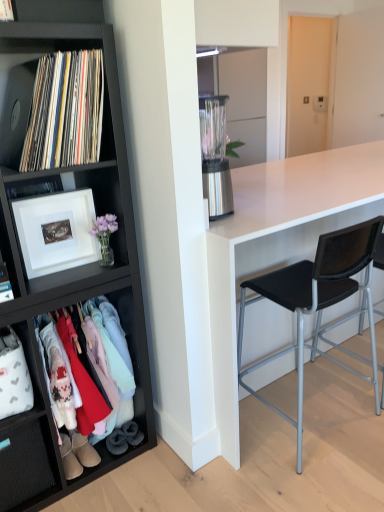
Question: Is white fabric drawer at lower left to the left of leather boot at lower left, which appears as the second footwear when viewed from the right, from the viewer's perspective?

Choices:
 (A) yes
 (B) no

Answer: (A)

Question: Considering the relative sizes of white fabric drawer at lower left and leather boot at lower left, which appears as the second footwear when viewed from the right, in the image provided, is white fabric drawer at lower left bigger than leather boot at lower left, which appears as the second footwear when viewed from the right,?

Choices:
 (A) yes
 (B) no

Answer: (A)

Question: Is leather boot at lower left, which appears as the second footwear when viewed from the right, inside white fabric drawer at lower left?

Choices:
 (A) yes
 (B) no

Answer: (B)

Question: Is white fabric drawer at lower left positioned behind leather boot at lower left, which appears as the second footwear when viewed from the right?

Choices:
 (A) no
 (B) yes

Answer: (A)

Question: Is white fabric drawer at lower left not inside leather boot at lower left, which appears as the second footwear when viewed from the right?

Choices:
 (A) yes
 (B) no

Answer: (A)

Question: From the image's perspective, is white fabric drawer at lower left above or below light brown suede boot at lower left, which ranks as the first footwear in right-to-left order?

Choices:
 (A) below
 (B) above

Answer: (B)

Question: Considering the positions of white fabric drawer at lower left and light brown suede boot at lower left, the second footwear when ordered from left to right, in the image, is white fabric drawer at lower left bigger or smaller than light brown suede boot at lower left, the second footwear when ordered from left to right,?

Choices:
 (A) small
 (B) big

Answer: (B)

Question: Is white fabric drawer at lower left in front of or behind light brown suede boot at lower left, which ranks as the first footwear in right-to-left order, in the image?

Choices:
 (A) front
 (B) behind

Answer: (A)

Question: From a real-world perspective, relative to light brown suede boot at lower left, which ranks as the first footwear in right-to-left order, is white fabric drawer at lower left vertically above or below?

Choices:
 (A) below
 (B) above

Answer: (B)

Question: Is point (342, 260) closer or farther from the camera than point (134, 226)?

Choices:
 (A) closer
 (B) farther

Answer: (A)

Question: Is black mesh chair at right, the second chair viewed from the right, taller or shorter than black matte bookcase at left?

Choices:
 (A) tall
 (B) short

Answer: (B)

Question: Is black mesh chair at right, the second chair viewed from the right, situated inside black matte bookcase at left or outside?

Choices:
 (A) inside
 (B) outside

Answer: (B)

Question: From the image's perspective, relative to black matte bookcase at left, is black mesh chair at right, which is the 1th chair in left-to-right order, above or below?

Choices:
 (A) above
 (B) below

Answer: (B)

Question: Based on their sizes in the image, would you say black matte bookcase at left is bigger or smaller than black vinyl records at left?

Choices:
 (A) small
 (B) big

Answer: (B)

Question: Based on their positions, is black matte bookcase at left located to the left or right of black vinyl records at left?

Choices:
 (A) left
 (B) right

Answer: (A)